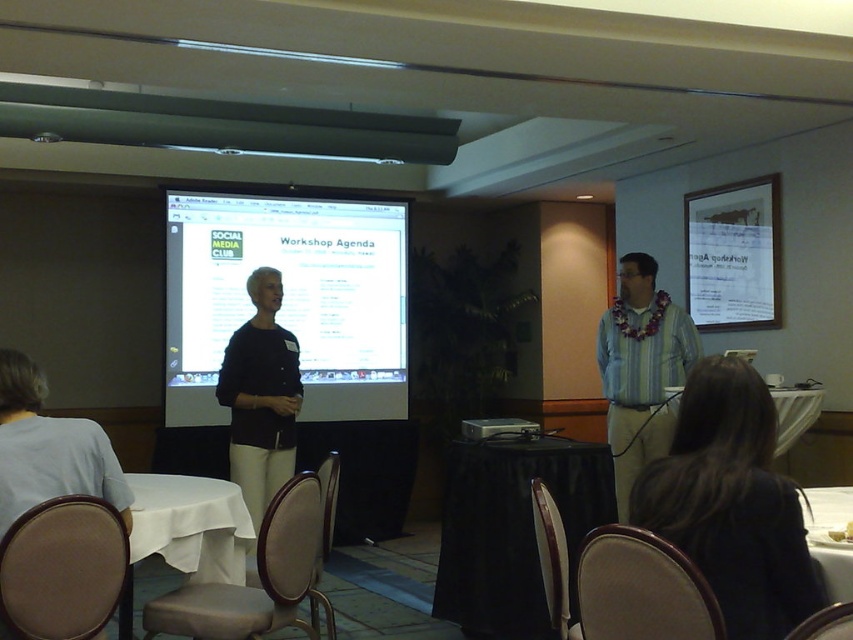
You are in a conference room and need to determine which of the two points, point (833, 554) or point (817, 401), is closer to you. Based on the scene, which point is nearer?

Point (833, 554) is closer to the viewer than point (817, 401).

You are attending a workshop and need to place a small notebook on the nearest surface. You see the black matte sweater at center and the white tablecloth at lower right. Which surface should you choose?

The black matte sweater at center is closer to the viewer than the white tablecloth at lower right, so you should place the notebook on the black matte sweater at center.

You are organizing a workshop and need to arrange seating based on the attendees clothing. The black fabric jacket at lower right and striped cotton shirt at center are present. Which clothing item takes up more visual space in the image?

The striped cotton shirt at center takes up more visual space than the black fabric jacket at lower right, as the black fabric jacket at lower right occupies less space than striped cotton shirt at center.